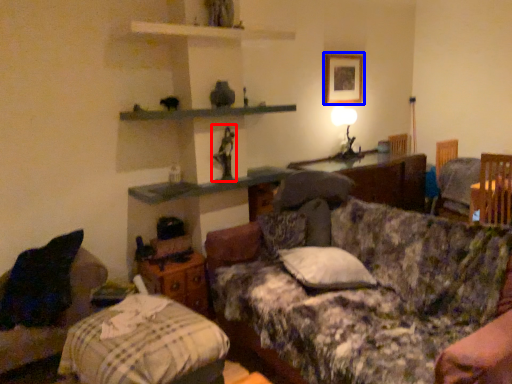
Question: Among these objects, which one is nearest to the camera, toy (highlighted by a red box) or picture frame (highlighted by a blue box)?

Choices:
 (A) toy
 (B) picture frame

Answer: (A)